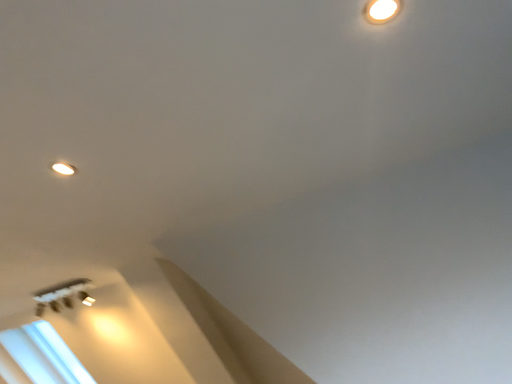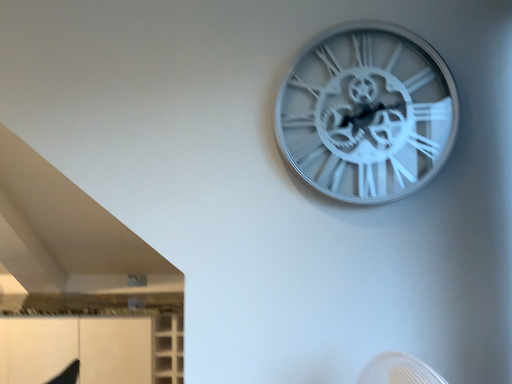
Question: How did the camera likely rotate when shooting the video?

Choices:
 (A) rotated upward
 (B) rotated downward

Answer: (B)